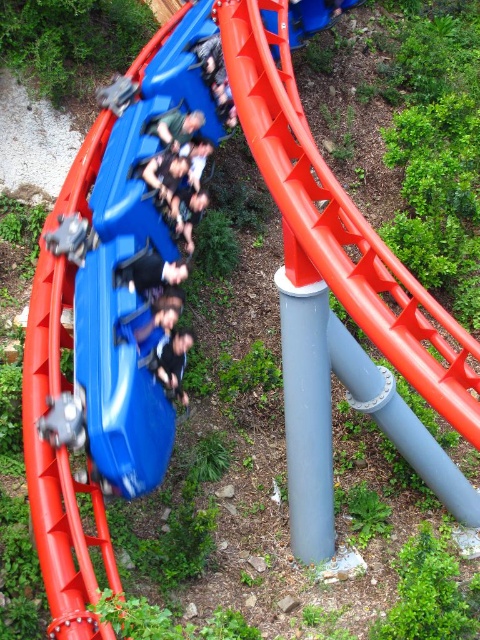
You are a safety inspector checking the roller coaster area. You see the smooth orange slide at center and the dark blue fabric at center. Which object is positioned higher in the scene?

The smooth orange slide at center is located above the dark blue fabric at center, so it is positioned higher in the scene.

Based on the scene description, where is the smooth orange slide at center located in terms of its 2D coordinates?

The smooth orange slide at center is located at the 2D coordinates of point [340,224].

You are a safety inspector checking the roller coaster area. You notice two items at the center of the scene. Which object is bigger? The smooth orange slide at center or the black matte gloves at center?

The smooth orange slide at center is larger in size than the black matte gloves at center.